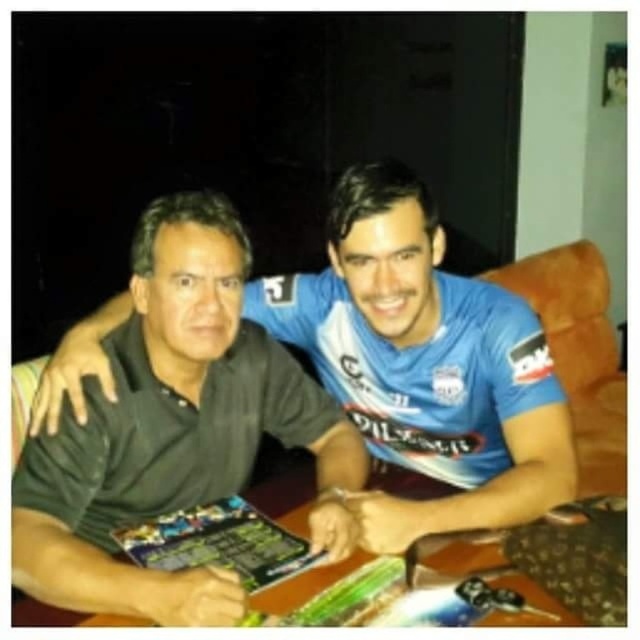
Question: Which object is closer to the camera taking this photo?

Choices:
 (A) wooden table at center
 (B) black matte shirt at center

Answer: (A)

Question: Is black matte shirt at center smaller than wooden table at center?

Choices:
 (A) no
 (B) yes

Answer: (A)

Question: Can you confirm if black matte shirt at center is smaller than wooden table at center?

Choices:
 (A) no
 (B) yes

Answer: (A)

Question: Which point is farther from the camera taking this photo?

Choices:
 (A) (536, 621)
 (B) (221, 401)

Answer: (B)

Question: Which point appears farthest from the camera in this image?

Choices:
 (A) (570, 616)
 (B) (29, 529)

Answer: (B)

Question: Is black matte shirt at center positioned behind wooden table at center?

Choices:
 (A) no
 (B) yes

Answer: (B)